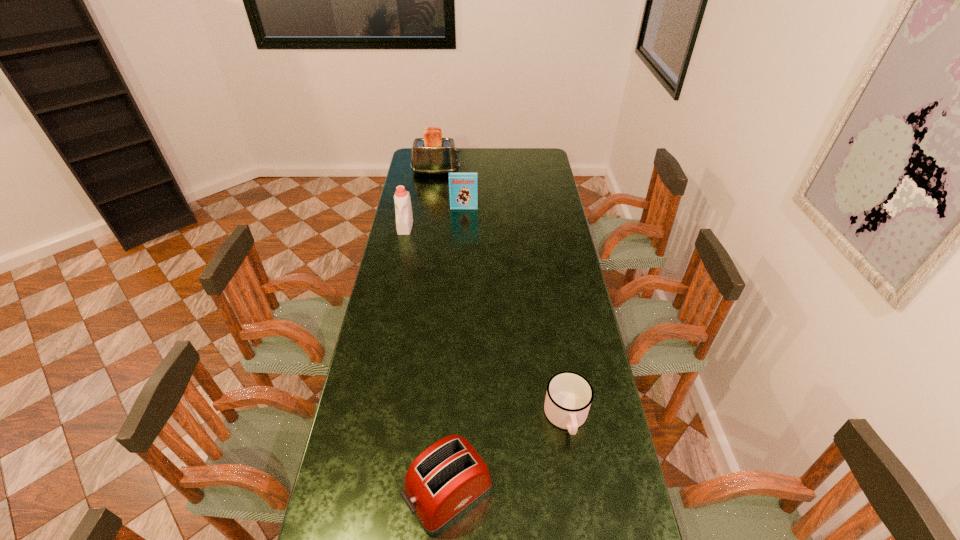
Image resolution: width=960 pixels, height=540 pixels. I want to click on vacant space located 0.310m on the front cover of the book, so click(462, 250).

At what (x,y) coordinates should I click in order to perform the action: click on vacant point located on the back of the shorter toaster. Please return your answer as a coordinate pair (x, y). Image resolution: width=960 pixels, height=540 pixels. Looking at the image, I should click on (452, 425).

Locate an element on the screen. The image size is (960, 540). vacant space positioned 0.150m on the side of the rightmost object with the handle is located at coordinates (579, 499).

Locate an element on the screen. object located in the far edge section of the desktop is located at coordinates (432, 154).

Identify the location of toaster positioned at the left edge. (432, 154).

Image resolution: width=960 pixels, height=540 pixels. Find the location of `detergent present at the left edge`. detergent present at the left edge is located at coordinates (404, 218).

At what (x,y) coordinates should I click in order to perform the action: click on object that is positioned at the right edge. Please return your answer as a coordinate pair (x, y). Looking at the image, I should click on (569, 395).

At what (x,y) coordinates should I click in order to perform the action: click on object that is positioned at the far left corner. Please return your answer as a coordinate pair (x, y). The image size is (960, 540). Looking at the image, I should click on (432, 154).

The height and width of the screenshot is (540, 960). I want to click on vacant space at the far edge, so click(x=515, y=168).

Find the location of a particular element. The width and height of the screenshot is (960, 540). blank space at the left edge of the desktop is located at coordinates (381, 367).